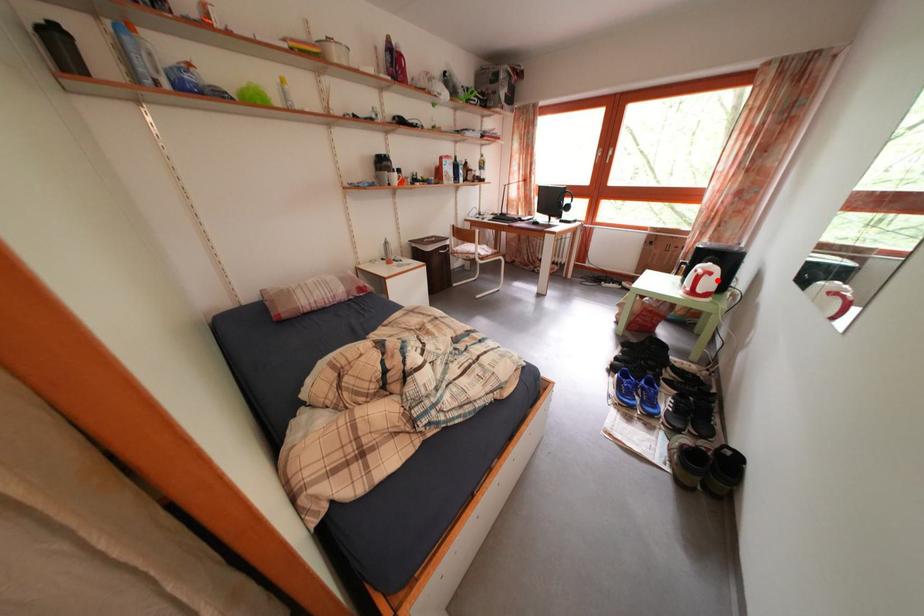
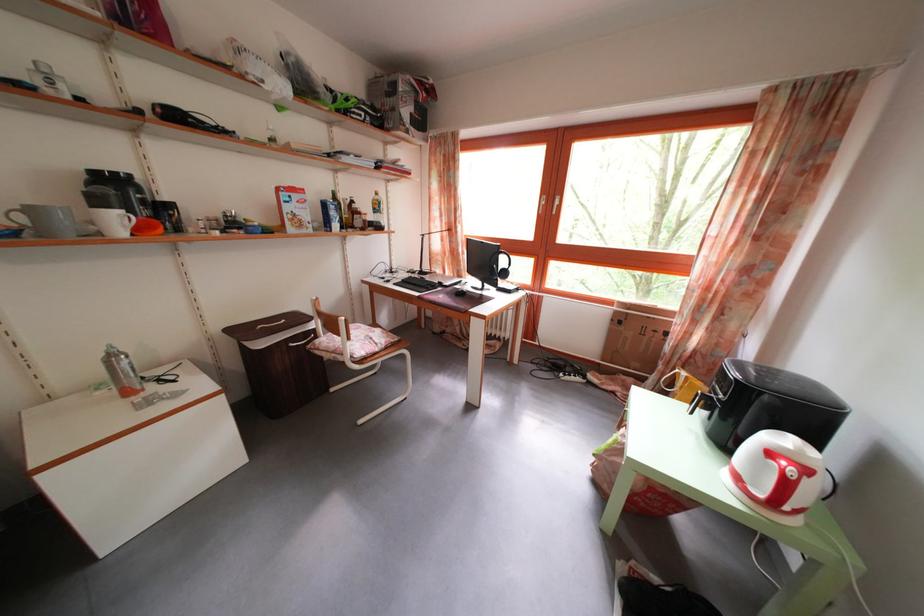
Where in the second image is the point corresponding to the highlighted location from the first image?

(812, 477)